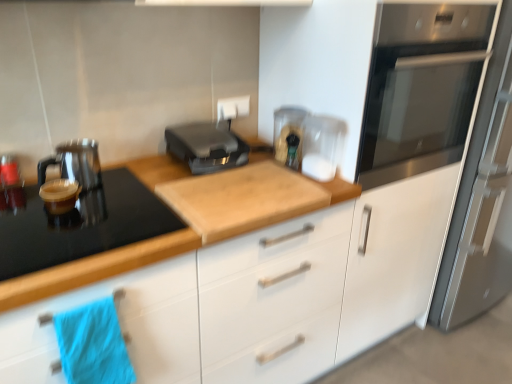
The width and height of the screenshot is (512, 384). I want to click on blank space situated above black glass gas stove at left (from a real-world perspective), so click(74, 215).